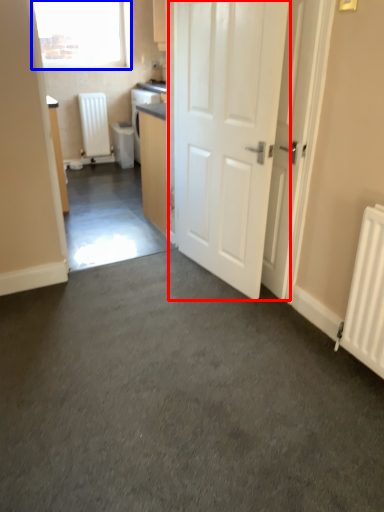
Question: Which of the following is the closest to the observer, door (highlighted by a red box) or window (highlighted by a blue box)?

Choices:
 (A) door
 (B) window

Answer: (A)